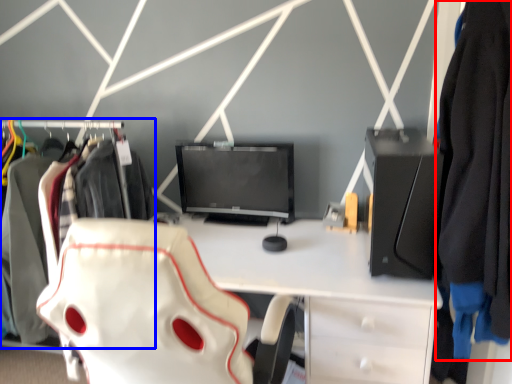
Question: Which point is further to the camera, clothing (highlighted by a red box) or closet (highlighted by a blue box)?

Choices:
 (A) clothing
 (B) closet

Answer: (B)